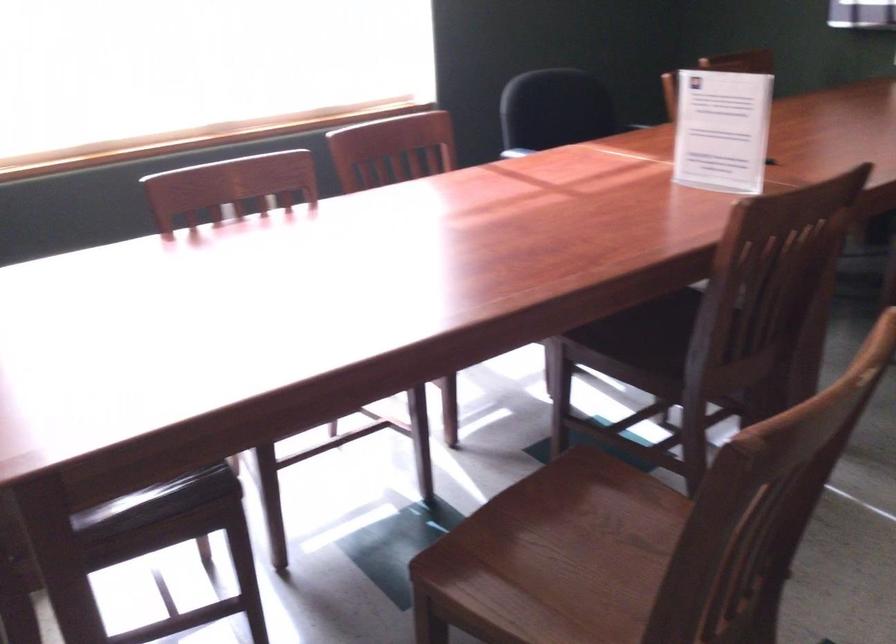
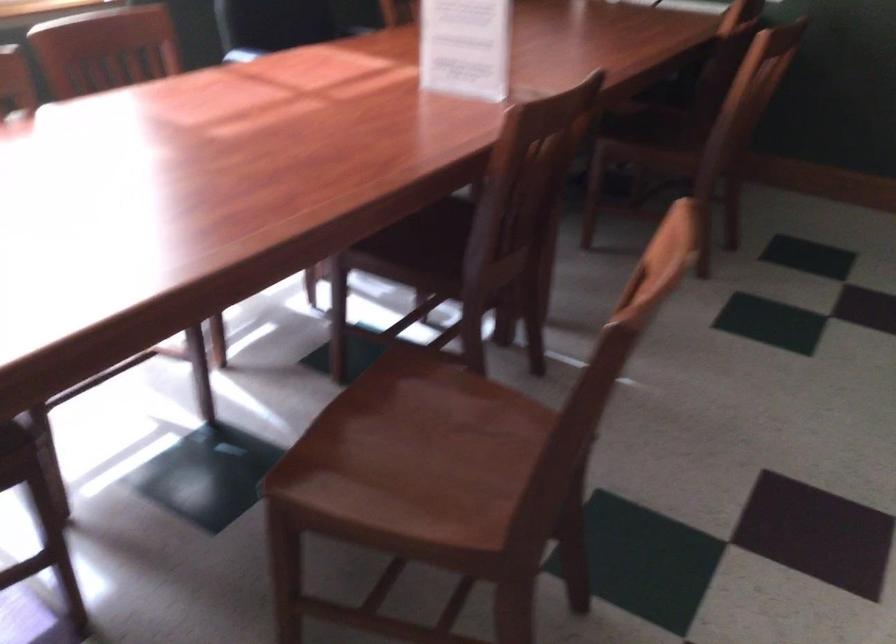
In the second image, find the point that corresponds to point 648,344 in the first image.

(418, 247)